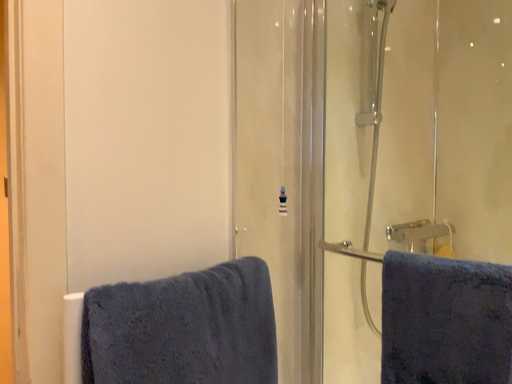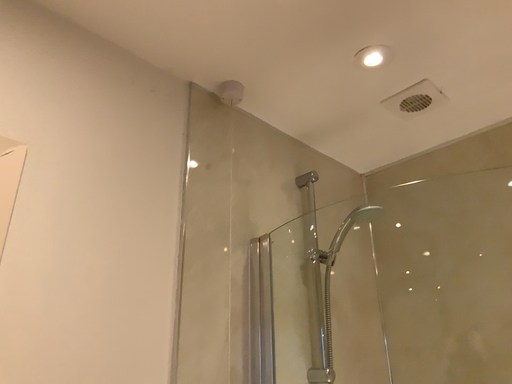
Question: Which way did the camera rotate in the video?

Choices:
 (A) rotated upward
 (B) rotated downward

Answer: (A)